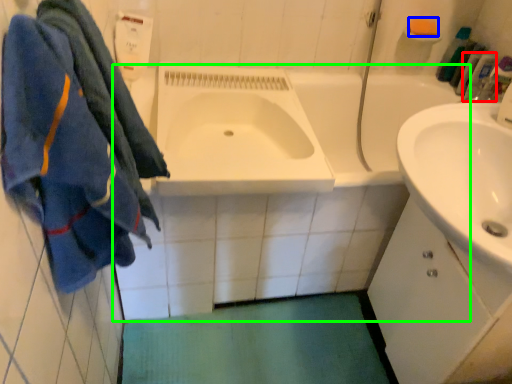
Question: Considering the real-world distances, which object is closest to toiletry (highlighted by a red box)? soap (highlighted by a blue box) or bath (highlighted by a green box).

Choices:
 (A) soap
 (B) bath

Answer: (A)